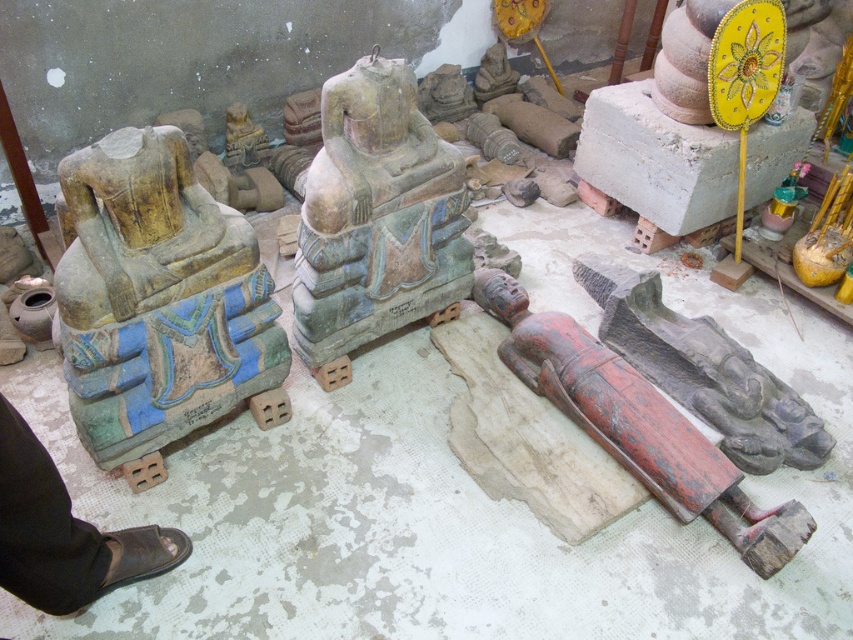
Question: Considering the real-world distances, which object is closest to the red painted wood figure at lower right?

Choices:
 (A) green stone statue at center
 (B) yellowish stone statue at left

Answer: (A)

Question: Considering the relative positions of yellowish stone statue at left and red painted wood figure at lower right in the image provided, where is yellowish stone statue at left located with respect to red painted wood figure at lower right?

Choices:
 (A) right
 (B) left

Answer: (B)

Question: Which point is closer to the camera?

Choices:
 (A) red painted wood figure at lower right
 (B) yellowish stone statue at left

Answer: (B)

Question: Among these points, which one is farthest from the camera?

Choices:
 (A) (99, 248)
 (B) (555, 376)
 (C) (444, 195)

Answer: (B)

Question: Observing the image, what is the correct spatial positioning of yellowish stone statue at left in reference to red painted wood figure at lower right?

Choices:
 (A) below
 (B) above

Answer: (B)

Question: Is green stone statue at center wider than red painted wood figure at lower right?

Choices:
 (A) no
 (B) yes

Answer: (A)